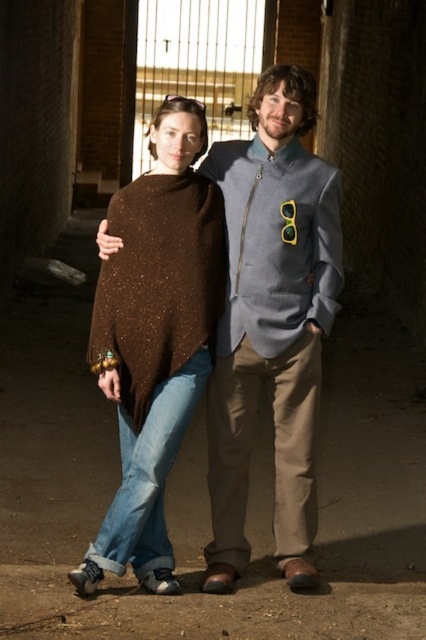
You are a photographer positioned in front of the two people in the alleyway. You want to take a photo focusing on the brown speckled knit shawl at center without the brown textured sweater at center blocking it. Is this possible given their positions?

The brown textured sweater at center is closer to the viewer than the brown speckled knit shawl at center, so the sweater would block the shawl in the photo. Adjust your angle or position to capture the shawl without obstruction.

You are a tailor trying to determine which item to adjust first. Since both the light blue textured jacket at center and the brown speckled knit shawl at center are visible in the image, which one should you prioritize based on their height?

The light blue textured jacket at center is taller than the brown speckled knit shawl at center, so the tailor should prioritize adjusting the light blue textured jacket at center first.